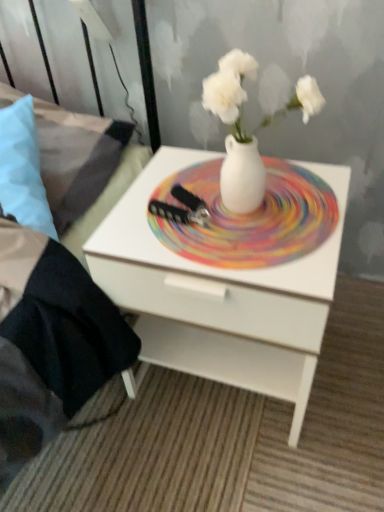
Question: From a real-world perspective, is white glossy nightstand at center beneath brushed metal bed frame at left?

Choices:
 (A) yes
 (B) no

Answer: (A)

Question: From the image's perspective, is white glossy nightstand at center on top of brushed metal bed frame at left?

Choices:
 (A) yes
 (B) no

Answer: (B)

Question: From the image's perspective, does white glossy nightstand at center appear lower than brushed metal bed frame at left?

Choices:
 (A) no
 (B) yes

Answer: (B)

Question: Is white glossy nightstand at center positioned behind brushed metal bed frame at left?

Choices:
 (A) yes
 (B) no

Answer: (A)

Question: Does white glossy nightstand at center have a lesser width compared to brushed metal bed frame at left?

Choices:
 (A) yes
 (B) no

Answer: (A)

Question: Based on their positions, is brushed metal bed frame at left located to the left or right of light blue fabric pillow at left?

Choices:
 (A) left
 (B) right

Answer: (A)

Question: From the image's perspective, is brushed metal bed frame at left above or below light blue fabric pillow at left?

Choices:
 (A) above
 (B) below

Answer: (A)

Question: Is point (21, 454) positioned closer to the camera than point (28, 163)?

Choices:
 (A) closer
 (B) farther

Answer: (A)

Question: In the image, is brushed metal bed frame at left positioned in front of or behind light blue fabric pillow at left?

Choices:
 (A) behind
 (B) front

Answer: (B)

Question: In terms of width, does white glossy nightstand at center look wider or thinner when compared to light blue fabric pillow at left?

Choices:
 (A) thin
 (B) wide

Answer: (B)

Question: Considering the relative positions of white glossy nightstand at center and light blue fabric pillow at left in the image provided, is white glossy nightstand at center to the left or to the right of light blue fabric pillow at left?

Choices:
 (A) left
 (B) right

Answer: (B)

Question: Considering the positions of white glossy nightstand at center and light blue fabric pillow at left in the image, is white glossy nightstand at center bigger or smaller than light blue fabric pillow at left?

Choices:
 (A) small
 (B) big

Answer: (B)

Question: Is white glossy nightstand at center inside the boundaries of light blue fabric pillow at left, or outside?

Choices:
 (A) outside
 (B) inside

Answer: (A)

Question: Do you think brushed metal bed frame at left is within white matte vase at center, or outside of it?

Choices:
 (A) inside
 (B) outside

Answer: (B)

Question: Is brushed metal bed frame at left taller or shorter than white matte vase at center?

Choices:
 (A) tall
 (B) short

Answer: (A)